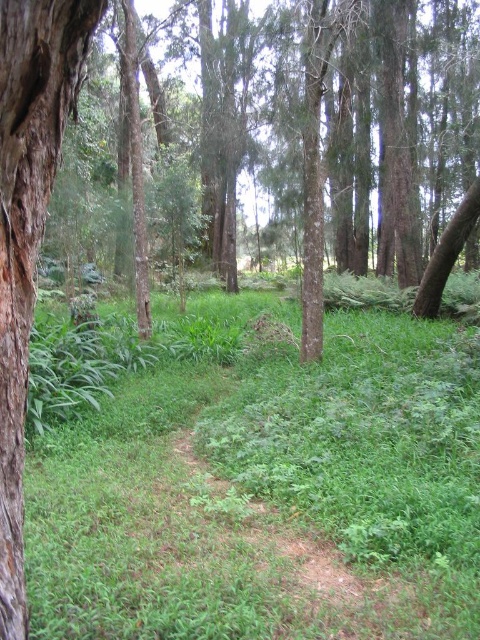
Question: Can you confirm if green leafy grass at center is positioned to the left of brown rough bark tree trunk at left?

Choices:
 (A) yes
 (B) no

Answer: (B)

Question: Can you confirm if green leafy grass at center is smaller than brown rough bark tree trunk at left?

Choices:
 (A) yes
 (B) no

Answer: (B)

Question: Is green leafy grass at center below brown rough bark tree trunk at left?

Choices:
 (A) yes
 (B) no

Answer: (A)

Question: Which point is closer to the camera taking this photo?

Choices:
 (A) (248, 380)
 (B) (20, 454)

Answer: (B)

Question: Which of the following is the closest to the observer?

Choices:
 (A) green leafy grass at center
 (B) brown rough bark tree trunk at left

Answer: (B)

Question: Among these points, which one is nearest to the camera?

Choices:
 (A) (396, 612)
 (B) (22, 282)

Answer: (B)